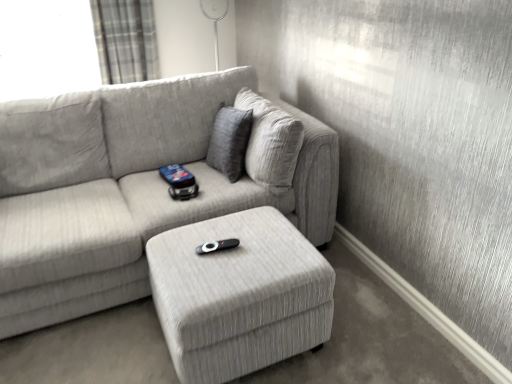
You are a GUI agent. You are given a task and a screenshot of the screen. Output one action in this format:
    pyautogui.click(x=<x>, y=<y>)
    Task: Click on the free spot to the left of black plastic remote at center
    The image size is (512, 384).
    Given the screenshot: What is the action you would take?
    click(x=182, y=244)